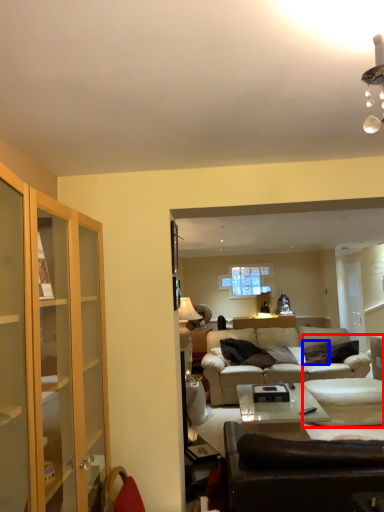
Question: Which point is closer to the camera, swivel chair (highlighted by a red box) or pillow (highlighted by a blue box)?

Choices:
 (A) swivel chair
 (B) pillow

Answer: (A)